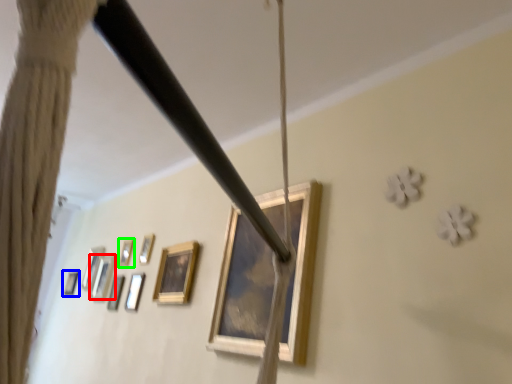
Question: Which object is the farthest from picture frame (highlighted by a red box)? Choose among these: picture frame (highlighted by a blue box) or picture frame (highlighted by a green box).

Choices:
 (A) picture frame
 (B) picture frame

Answer: (A)